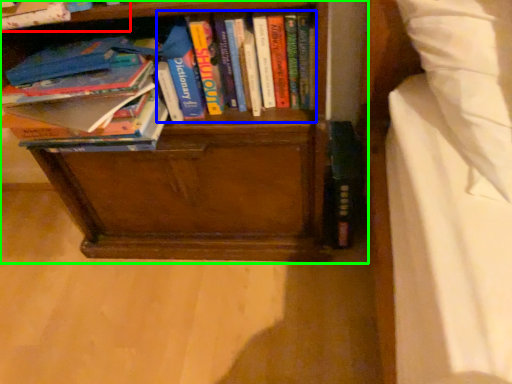
Question: Considering the real-world distances, which object is farthest from book (highlighted by a red box)? book (highlighted by a blue box) or bookcase (highlighted by a green box)?

Choices:
 (A) book
 (B) bookcase

Answer: (B)